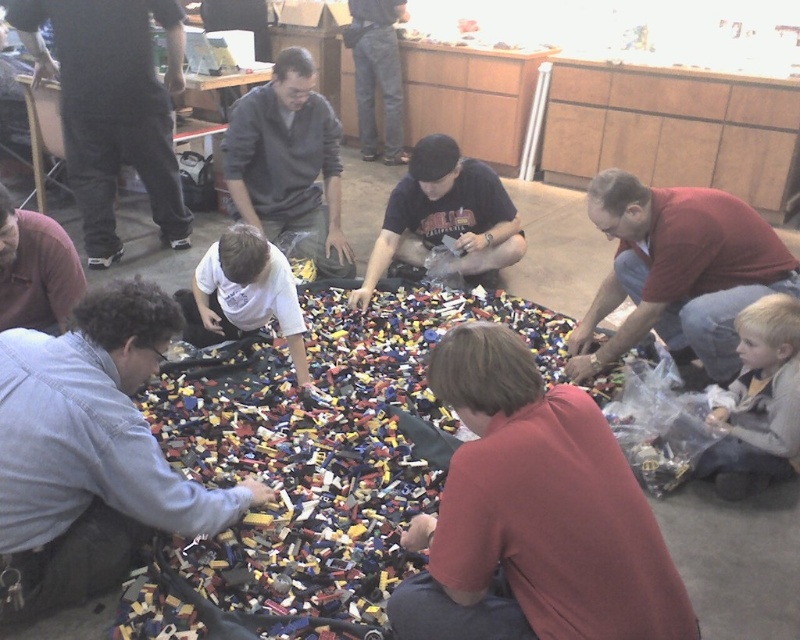
You are part of the group sorting LEGO bricks. You need to find the matte red shirt at center. Which direction should you look relative to the multicolored plastic bricks at center?

The multicolored plastic bricks at center are to the left of the matte red shirt at center, so you should look to the right of the multicolored plastic bricks at center to find the matte red shirt at center.